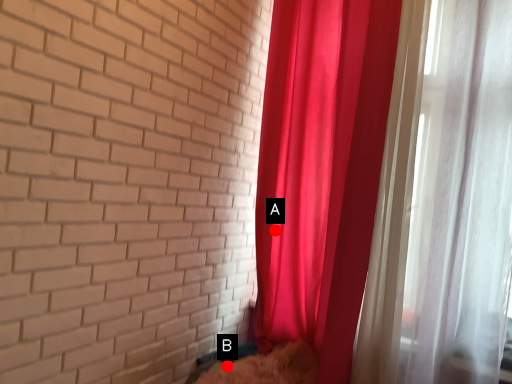
Question: Two points are circled on the image, labeled by A and B beside each circle. Which of the following is the farthest from the observer?

Choices:
 (A) A is further
 (B) B is further

Answer: (A)